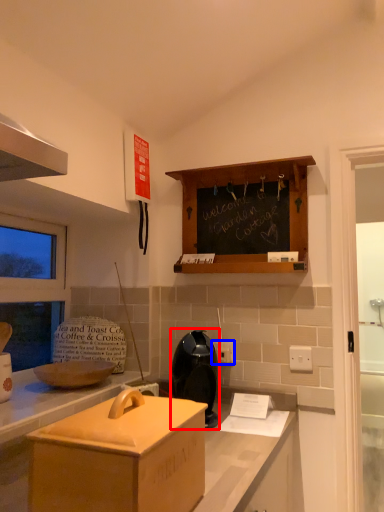
Question: Among these objects, which one is nearest to the camera, appliance (highlighted by a red box) or electric outlet (highlighted by a blue box)?

Choices:
 (A) appliance
 (B) electric outlet

Answer: (A)